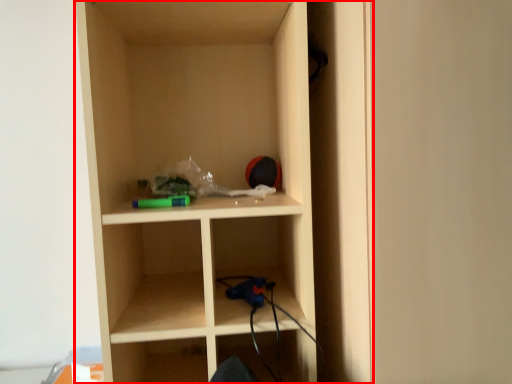
Question: From the image's perspective, considering the relative positions of shelf (annotated by the red box) and door in the image provided, where is shelf (annotated by the red box) located with respect to the staircase?

Choices:
 (A) above
 (B) below

Answer: (A)